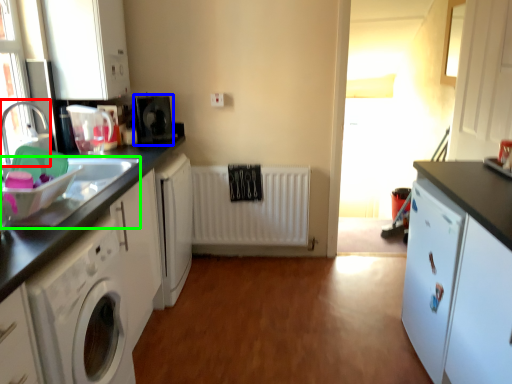
Question: Which object is the farthest from faucet (highlighted by a red box)? Choose among these: appliance (highlighted by a blue box) or sink (highlighted by a green box).

Choices:
 (A) appliance
 (B) sink

Answer: (A)